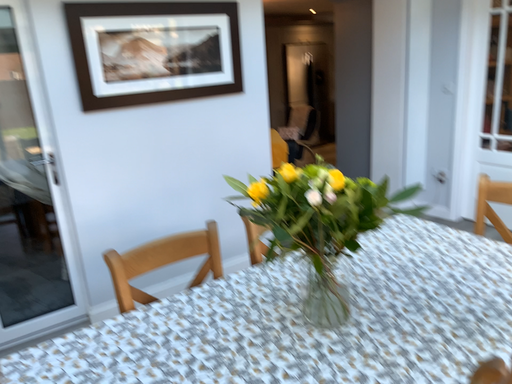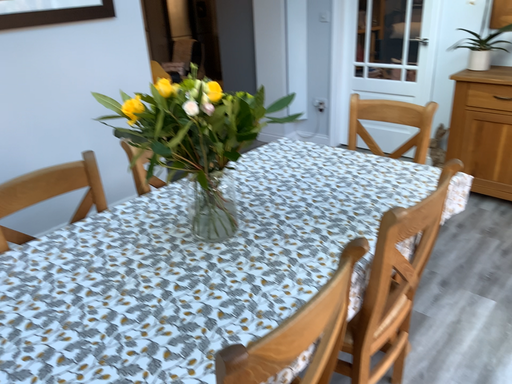
Question: Which way did the camera rotate in the video?

Choices:
 (A) rotated left
 (B) rotated right

Answer: (B)